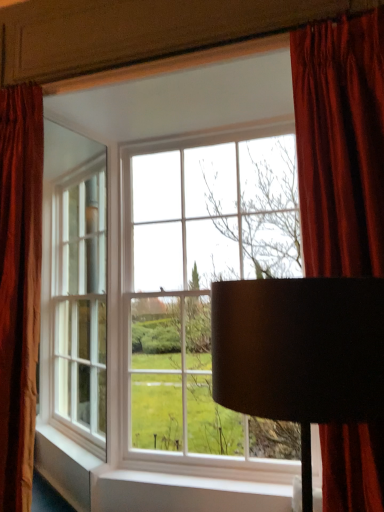
Question: Can you confirm if black matte lampshade at center is thinner than velvet red curtain at upper right, marked as the 2th curtain in a left-to-right arrangement?

Choices:
 (A) no
 (B) yes

Answer: (A)

Question: Does black matte lampshade at center appear on the right side of velvet red curtain at upper right, which is the first curtain from right to left?

Choices:
 (A) yes
 (B) no

Answer: (B)

Question: Are black matte lampshade at center and velvet red curtain at upper right, marked as the 2th curtain in a left-to-right arrangement, far apart?

Choices:
 (A) yes
 (B) no

Answer: (B)

Question: From the image's perspective, is black matte lampshade at center below velvet red curtain at upper right, marked as the 2th curtain in a left-to-right arrangement?

Choices:
 (A) no
 (B) yes

Answer: (B)

Question: Is velvet red curtain at upper right, which is the first curtain from right to left, completely or partially inside black matte lampshade at center?

Choices:
 (A) yes
 (B) no

Answer: (B)

Question: Is black matte lampshade at center outside of velvet red curtain at upper right, which is the first curtain from right to left?

Choices:
 (A) yes
 (B) no

Answer: (A)

Question: Is velvet red curtain at left, which is counted as the 1th curtain, starting from the left, far from velvet red curtain at upper right, marked as the 2th curtain in a left-to-right arrangement?

Choices:
 (A) no
 (B) yes

Answer: (B)

Question: Is velvet red curtain at left, the 2th curtain in the right-to-left sequence, shorter than velvet red curtain at upper right, which is the first curtain from right to left?

Choices:
 (A) no
 (B) yes

Answer: (A)

Question: From a real-world perspective, is velvet red curtain at left, which is counted as the 1th curtain, starting from the left, on velvet red curtain at upper right, which is the first curtain from right to left?

Choices:
 (A) yes
 (B) no

Answer: (B)

Question: Considering the relative positions of velvet red curtain at left, which is counted as the 1th curtain, starting from the left, and velvet red curtain at upper right, marked as the 2th curtain in a left-to-right arrangement, in the image provided, is velvet red curtain at left, which is counted as the 1th curtain, starting from the left, behind velvet red curtain at upper right, marked as the 2th curtain in a left-to-right arrangement,?

Choices:
 (A) no
 (B) yes

Answer: (B)

Question: Is velvet red curtain at left, which is counted as the 1th curtain, starting from the left, located outside velvet red curtain at upper right, marked as the 2th curtain in a left-to-right arrangement?

Choices:
 (A) yes
 (B) no

Answer: (A)

Question: Is velvet red curtain at left, the 2th curtain in the right-to-left sequence, to the left of velvet red curtain at upper right, marked as the 2th curtain in a left-to-right arrangement, from the viewer's perspective?

Choices:
 (A) yes
 (B) no

Answer: (A)

Question: Is matte glass window at center positioned before velvet red curtain at upper right, marked as the 2th curtain in a left-to-right arrangement?

Choices:
 (A) yes
 (B) no

Answer: (B)